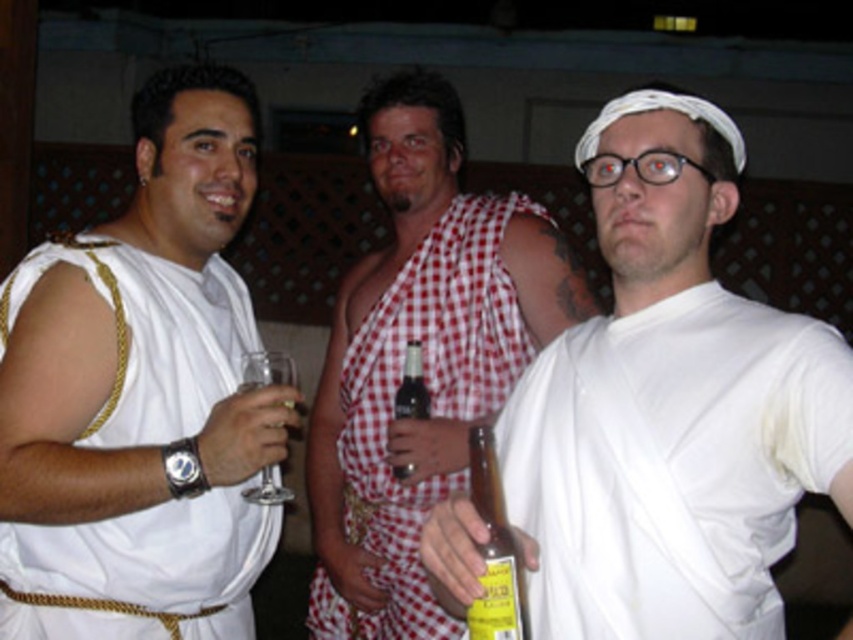
You are at a themed party and see two bottles, a yellow glass bottle at center and a brown glass bottle at center. Which one has a larger diameter?

The yellow glass bottle at center might be wider than brown glass bottle at center.

You are taking a photo of two points in the image. The first point is at coordinates point (x=421, y=532) and the second point is at point (x=437, y=228). Which point will appear larger in your photo?

Point (x=421, y=532) is closer to the camera than point (x=437, y=228), so it will appear larger in the photo.